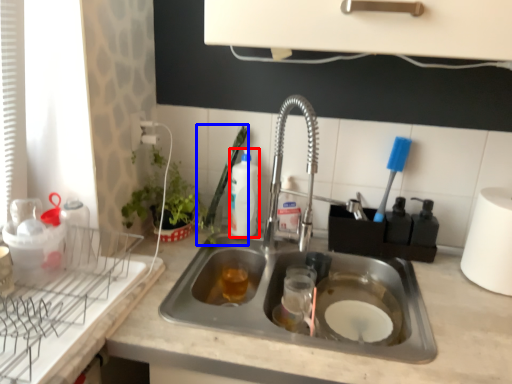
Question: Which object appears farthest to the camera in this image, beverage (highlighted by a red box) or brush (highlighted by a blue box)?

Choices:
 (A) beverage
 (B) brush

Answer: (A)